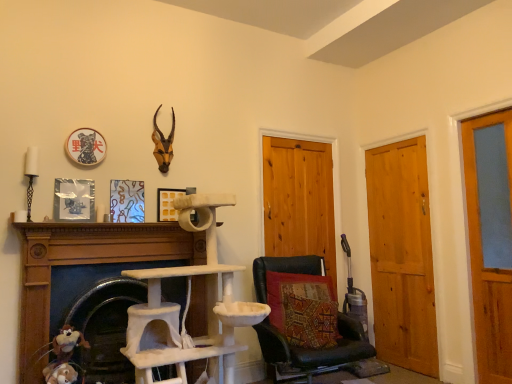
Locate an element on the screen. Image resolution: width=512 pixels, height=384 pixels. empty space that is ontop of wooden door at center, acting as the first door starting from the left (from a real-world perspective) is located at coordinates (300, 136).